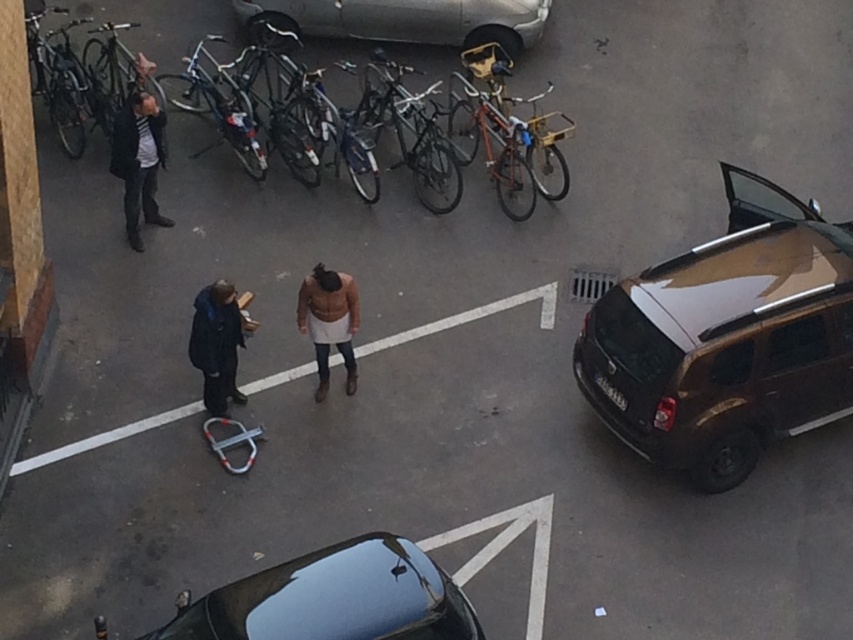
Question: Which object is closer to the camera taking this photo?

Choices:
 (A) shiny metallic bicycle at left
 (B) brown leather jacket at center
 (C) dark blue jacket at center

Answer: (C)

Question: Which object appears farthest from the camera in this image?

Choices:
 (A) dark gray jacket at left
 (B) shiny black car at lower center

Answer: (A)

Question: Where is shiny black car at lower center located in relation to silver metallic car at upper center in the image?

Choices:
 (A) above
 (B) below

Answer: (B)

Question: Can you confirm if shiny brown suv at right is thinner than dark gray jacket at left?

Choices:
 (A) no
 (B) yes

Answer: (A)

Question: Where is shiny black car at lower center located in relation to brown leather jacket at center in the image?

Choices:
 (A) left
 (B) right

Answer: (B)

Question: Which object appears farthest from the camera in this image?

Choices:
 (A) brown leather jacket at center
 (B) shiny brown suv at right
 (C) shiny black car at lower center
 (D) silver metallic car at upper center

Answer: (D)